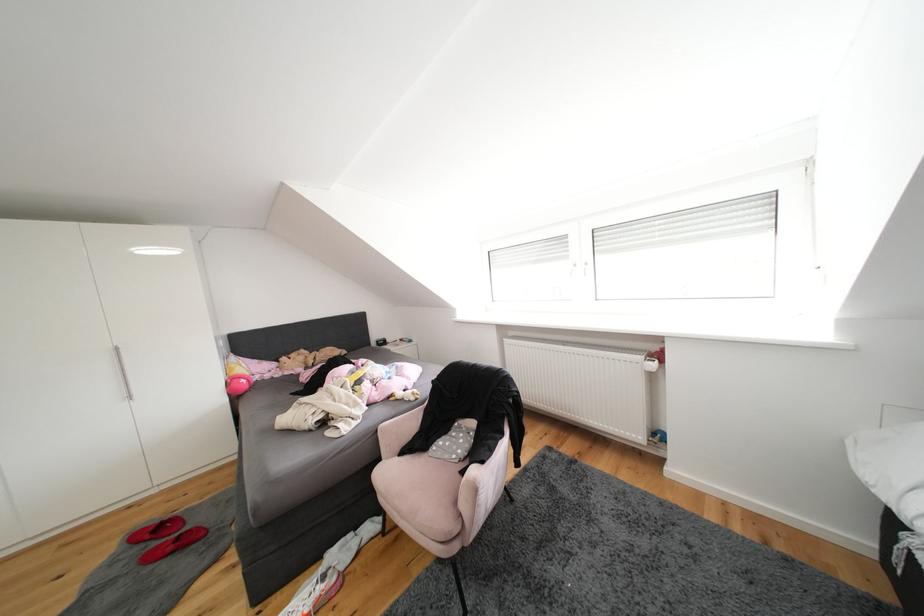
Find where to turn the white window handle. Please return your answer as a coordinate pair (x, y).

(589, 265)